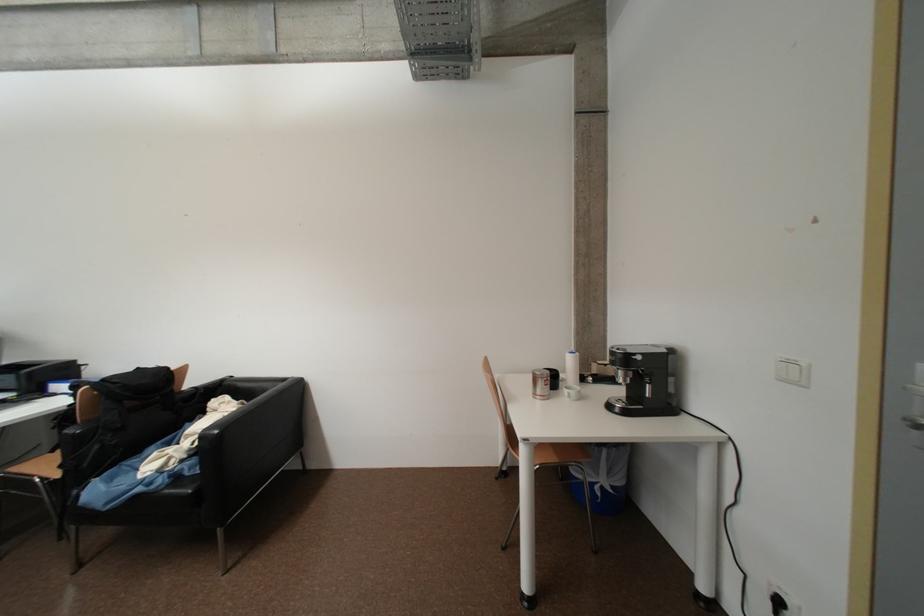
Find where to sit the chair sitting surface. Please return your answer as a coordinate pair (x, y).

(153, 469)